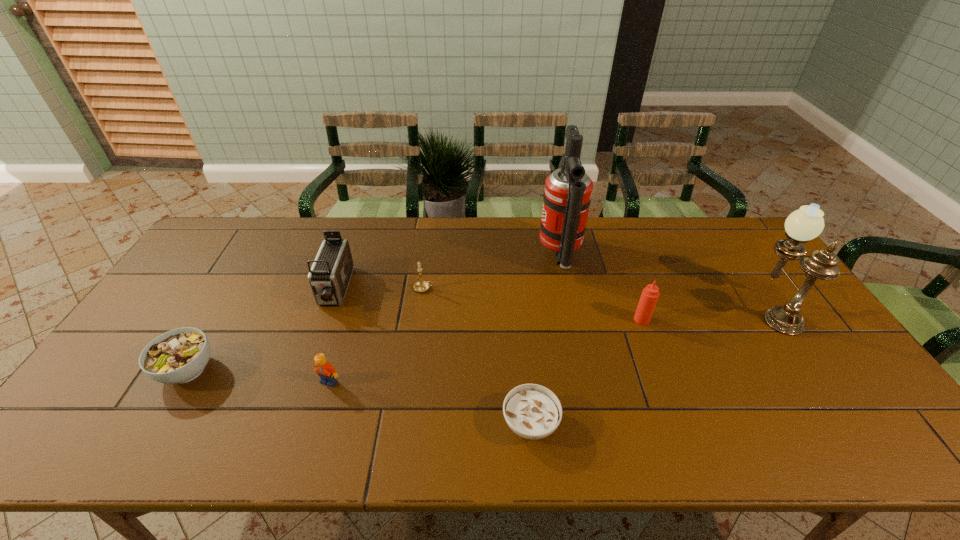
Identify the location of the sixth object from left to right. The height and width of the screenshot is (540, 960). (567, 196).

Where is `fire extinguisher`? fire extinguisher is located at coordinates (567, 196).

What are the coordinates of `oil lamp` in the screenshot? It's located at (805, 224).

Identify the location of the second tallest object. The height and width of the screenshot is (540, 960). (805, 224).

I want to click on camcorder, so click(x=329, y=277).

The width and height of the screenshot is (960, 540). Identify the location of the second object from right to left. (650, 294).

This screenshot has height=540, width=960. Find the location of `the fourth object from left to right`. the fourth object from left to right is located at coordinates (421, 286).

You are a GUI agent. You are given a task and a screenshot of the screen. Output one action in this format:
    pyautogui.click(x=<x>, y=<y>)
    Task: Click on the Lego
    This screenshot has width=960, height=540.
    Given the screenshot: What is the action you would take?
    pyautogui.click(x=323, y=368)

Where is `the left soup bowl`? the left soup bowl is located at coordinates (180, 355).

The image size is (960, 540). I want to click on the leftmost object, so click(x=180, y=355).